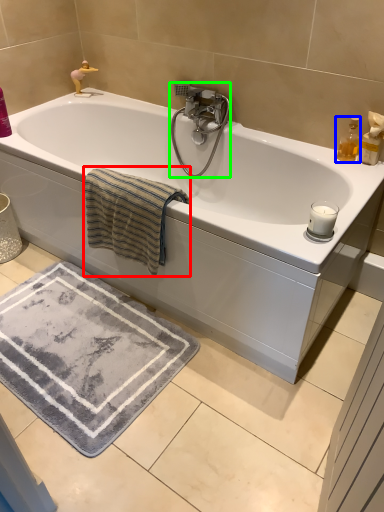
Question: Estimate the real-world distances between objects in this image. Which object is farther from bath towel (highlighted by a red box), soap dispenser (highlighted by a blue box) or tap (highlighted by a green box)?

Choices:
 (A) soap dispenser
 (B) tap

Answer: (A)